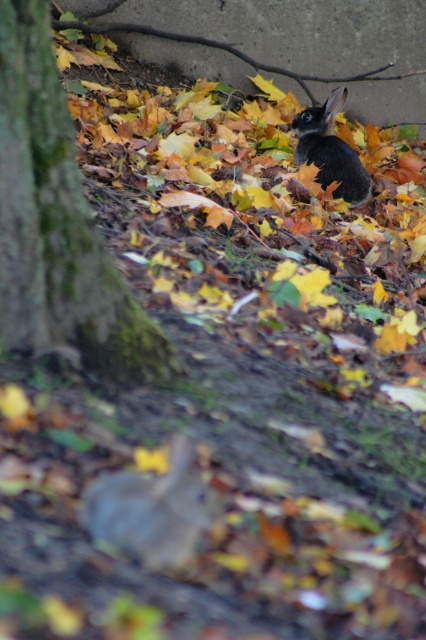
From the picture: You are standing in an autumn forest and see two points marked in the scene. The first point is at coordinates point (11, 106) and the second is at point (143, 486). Which point is closer to you?

Point (11, 106) is closer to you because it is further to the camera than point (143, 486).

You are an animal tracker trying to identify which rabbit is closer to you. You see a fuzzy gray rabbit at lower center and a black fur rabbit at center. Based on their size in the image, which rabbit do you think is closer?

The fuzzy gray rabbit at lower center occupies less space than black fur rabbit at center, so the black fur rabbit at center is closer because objects closer to the viewer appear larger in the image.

You are a photographer trying to capture both the fuzzy gray rabbit at lower center and the black fur rabbit at center in a single shot. Based on their positions, which rabbit would appear closer to the camera in the photo?

The fuzzy gray rabbit at lower center appears closer to the camera because it is located below the black fur rabbit at center, indicating it is in a lower and nearer position within the frame.